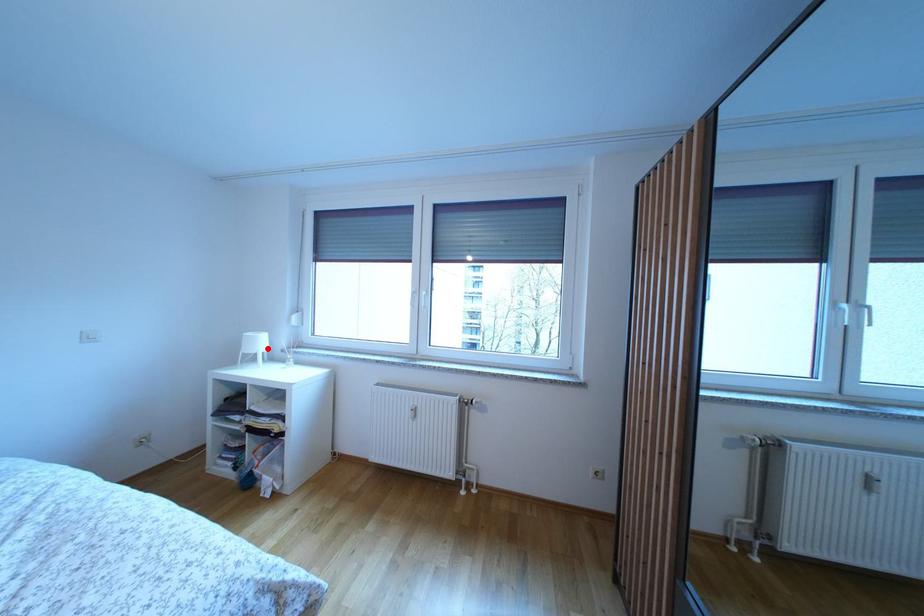
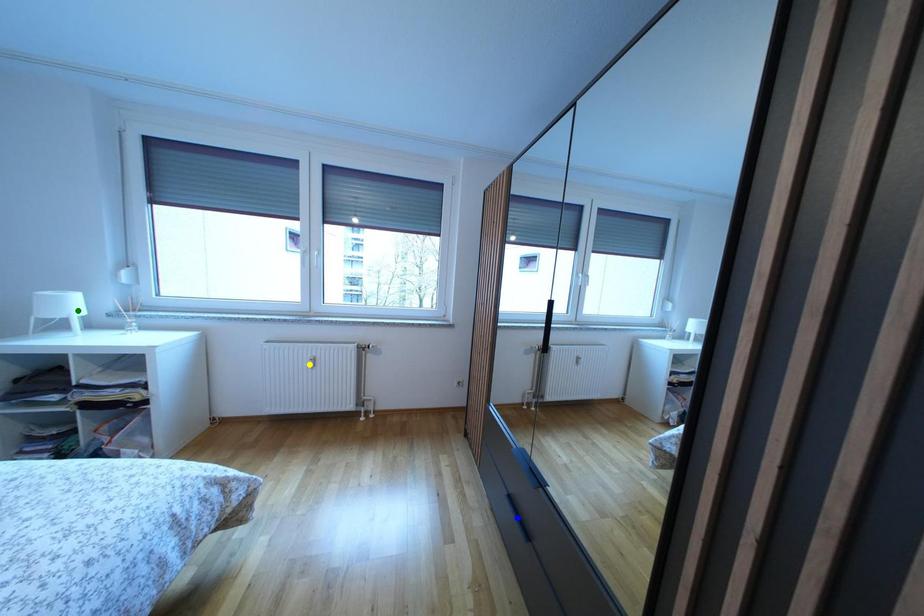
Question: I am providing you with two images of the same scene from different viewpoints. A red point is marked on the first image. You are given multiple points on the second image. Can you choose the point in image 2 that corresponds to the point in image 1?

Choices:
 (A) green point
 (B) yellow point
 (C) blue point

Answer: (A)